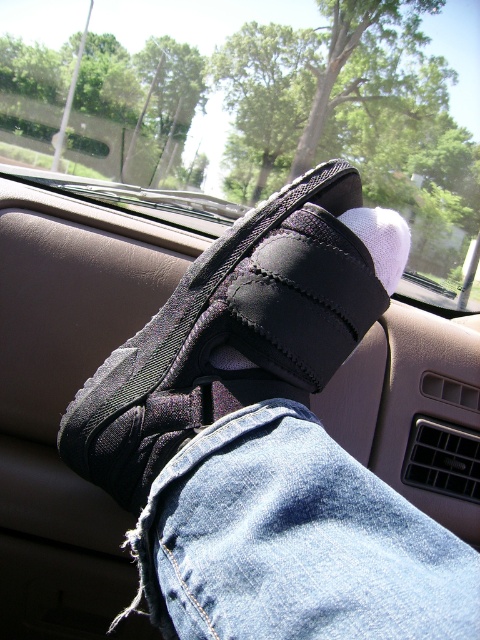
Question: Estimate the real-world distances between objects in this image. Which object is closer to the denim at center?

Choices:
 (A) black fabric shoe at center
 (B) transparent glass car window at center
 (C) white knitted sock at center

Answer: (A)

Question: Can you confirm if transparent glass car window at center is positioned below denim at center?

Choices:
 (A) no
 (B) yes

Answer: (A)

Question: Which of the following is the closest to the observer?

Choices:
 (A) denim at center
 (B) black fabric shoe at center

Answer: (A)

Question: Observing the image, what is the correct spatial positioning of transparent glass car window at center in reference to white knitted sock at center?

Choices:
 (A) above
 (B) below

Answer: (A)

Question: Considering the relative positions of transparent glass car window at center and black fabric shoe at center in the image provided, where is transparent glass car window at center located with respect to black fabric shoe at center?

Choices:
 (A) left
 (B) right

Answer: (A)

Question: Which point appears farthest from the camera in this image?

Choices:
 (A) (314, 321)
 (B) (303, 548)
 (C) (420, 252)
 (D) (374, 243)

Answer: (C)